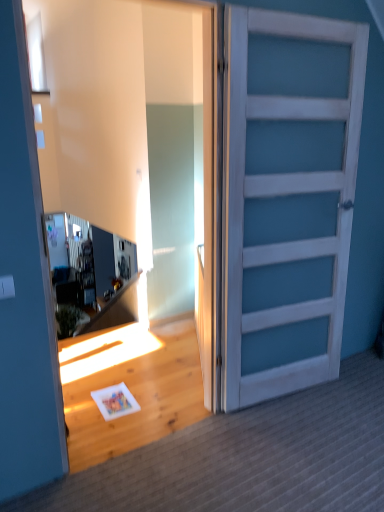
The width and height of the screenshot is (384, 512). Describe the element at coordinates (287, 197) in the screenshot. I see `white wooden door at right` at that location.

I want to click on white wooden door at right, so click(287, 197).

Locate an element on the screen. white wooden door at right is located at coordinates (287, 197).